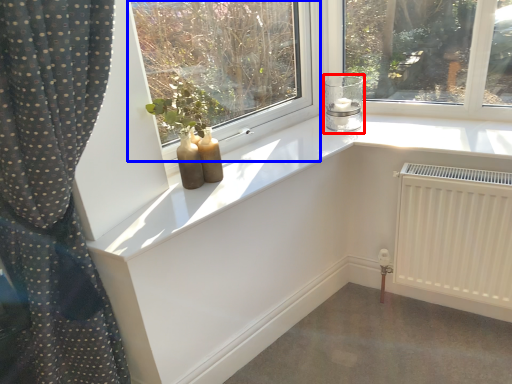
Question: Which object appears closest to the camera in this image, candle holder (highlighted by a red box) or window (highlighted by a blue box)?

Choices:
 (A) candle holder
 (B) window

Answer: (B)